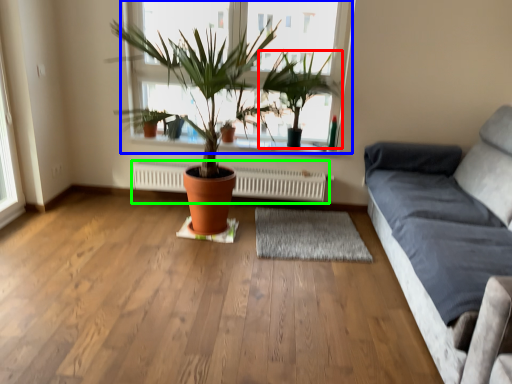
Question: Considering the real-world distances, which object is closest to houseplant (highlighted by a red box)? window (highlighted by a blue box) or heater (highlighted by a green box).

Choices:
 (A) window
 (B) heater

Answer: (A)